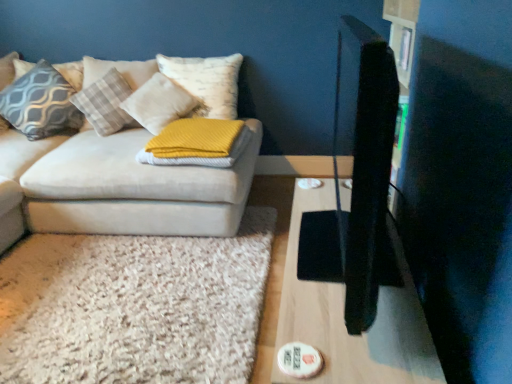
Where is `blank space situated above wooden table at right (from a real-world perspective)`? blank space situated above wooden table at right (from a real-world perspective) is located at coordinates (333, 262).